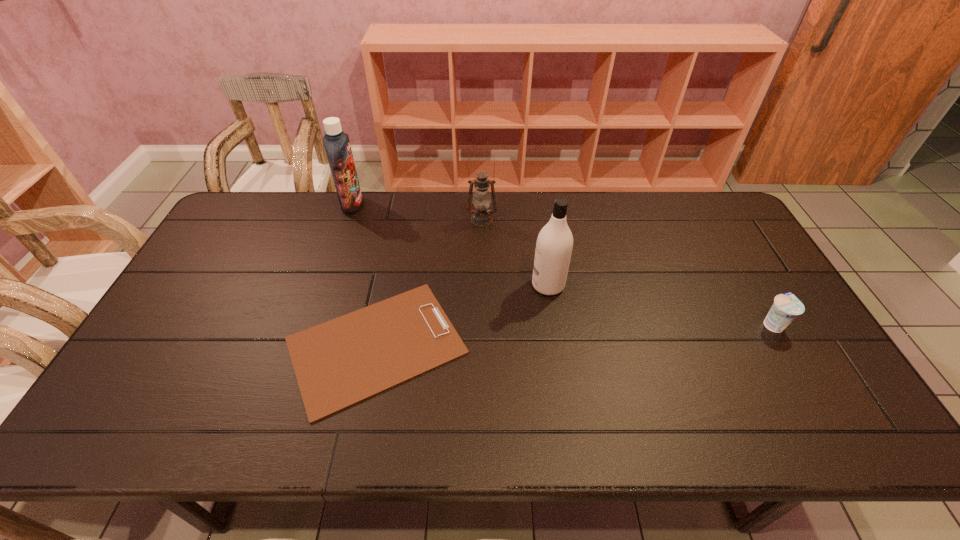
Image resolution: width=960 pixels, height=540 pixels. Identify the location of vacant space located 0.200m on the front-facing side of the nearer shampoo. (464, 285).

Locate an element on the screen. The height and width of the screenshot is (540, 960). vacant area situated on the right of the oil lamp is located at coordinates (523, 220).

You are a GUI agent. You are given a task and a screenshot of the screen. Output one action in this format:
    pyautogui.click(x=<x>, y=<y>)
    Task: Click on the vacant space located 0.340m on the left of the yogurt
    The width and height of the screenshot is (960, 540).
    Given the screenshot: What is the action you would take?
    635,325

Locate an element on the screen. This screenshot has height=540, width=960. vacant space located 0.130m on the right of the shortest object is located at coordinates (518, 346).

Find the location of a particular element. The image size is (960, 540). shampoo that is positioned at the far edge is located at coordinates (336, 143).

Identify the location of oil lamp that is positioned at the far edge. The height and width of the screenshot is (540, 960). (481, 216).

The image size is (960, 540). What are the coordinates of `object present at the near edge` in the screenshot? It's located at (341, 362).

Where is `object located in the right edge section of the desktop`? object located in the right edge section of the desktop is located at coordinates (786, 307).

Image resolution: width=960 pixels, height=540 pixels. I want to click on vacant area at the far edge of the desktop, so click(503, 208).

Where is `free space at the near edge of the desktop`? free space at the near edge of the desktop is located at coordinates (378, 425).